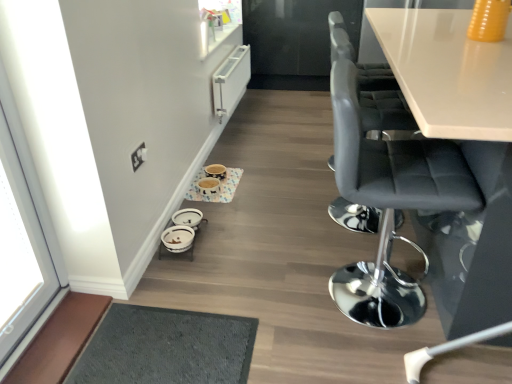
Identify the location of free space to the back side of gray fabric chair at right, the 1th chair when ordered from back to front. (312, 175).